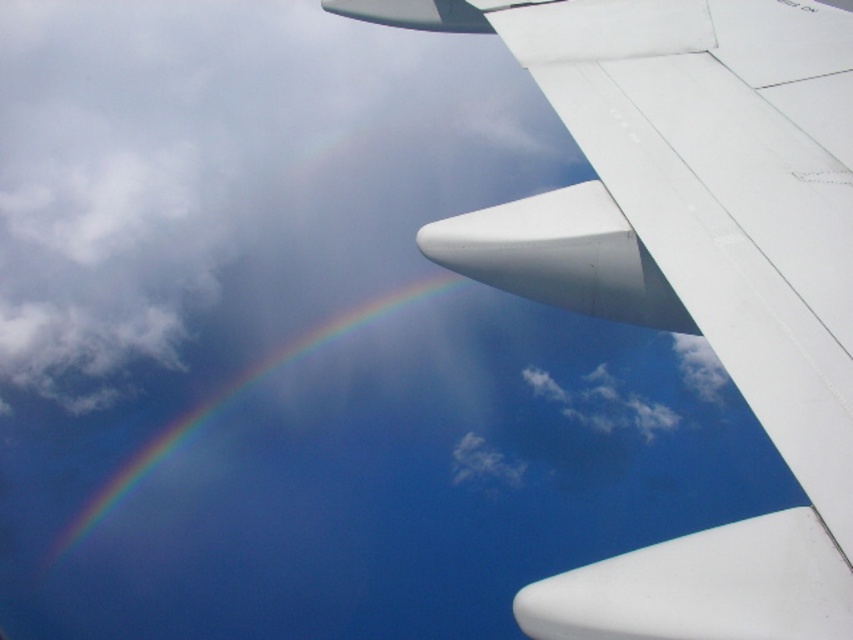
Question: Which point is farther to the camera?

Choices:
 (A) rainbow at upper left
 (B) white matte airplane wing at upper right

Answer: (A)

Question: Is white matte airplane wing at upper right smaller than rainbow at upper left?

Choices:
 (A) yes
 (B) no

Answer: (A)

Question: Is white matte airplane wing at upper right smaller than rainbow at upper left?

Choices:
 (A) yes
 (B) no

Answer: (A)

Question: Can you confirm if white matte airplane wing at upper right is positioned above rainbow at upper left?

Choices:
 (A) yes
 (B) no

Answer: (A)

Question: Which object appears closest to the camera in this image?

Choices:
 (A) white matte airplane wing at upper right
 (B) rainbow at upper left

Answer: (A)